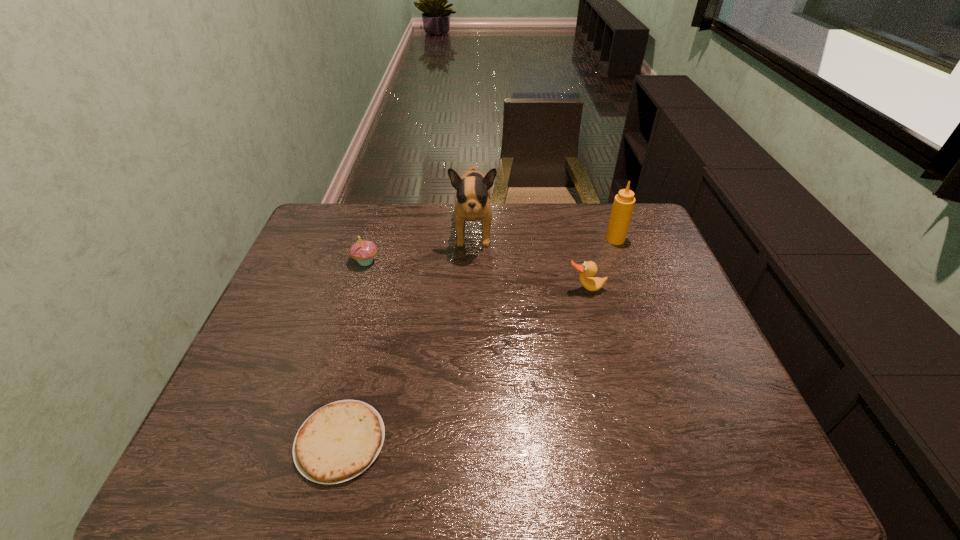
Identify the location of vacant area between the puppy and the rightmost object. (544, 235).

Locate an element on the screen. The image size is (960, 540). empty space that is in between the fourth farthest object and the shortest object is located at coordinates (463, 365).

What are the coordinates of `unoccupied area between the shortest object and the third object from left to right` in the screenshot? It's located at click(x=407, y=336).

The image size is (960, 540). What are the coordinates of `free area in between the fourth shortest object and the second nearest object` in the screenshot? It's located at (601, 264).

You are a GUI agent. You are given a task and a screenshot of the screen. Output one action in this format:
    pyautogui.click(x=<x>, y=<y>)
    Task: Click on the free space between the tortilla and the rightmost object
    
    Given the screenshot: What is the action you would take?
    pyautogui.click(x=478, y=340)

Identify which object is the second nearest to the fourth shortest object. Please provide its 2D coordinates. Your answer should be formatted as a tuple, i.e. [(x, y)], where the tuple contains the x and y coordinates of a point satisfying the conditions above.

[(473, 194)]

Locate an element on the screen. The width and height of the screenshot is (960, 540). object that is the second closest to the fourth farthest object is located at coordinates (473, 194).

Find the location of a particular element. Image resolution: width=960 pixels, height=540 pixels. vacant space that satisfies the following two spatial constraints: 1. at the face of the rightmost object; 2. on the right side of the third object from left to right is located at coordinates (473, 239).

This screenshot has width=960, height=540. What are the coordinates of `free point that satisfies the following two spatial constraints: 1. on the front side of the nearest object; 2. on the left side of the cupcake` in the screenshot? It's located at (312, 441).